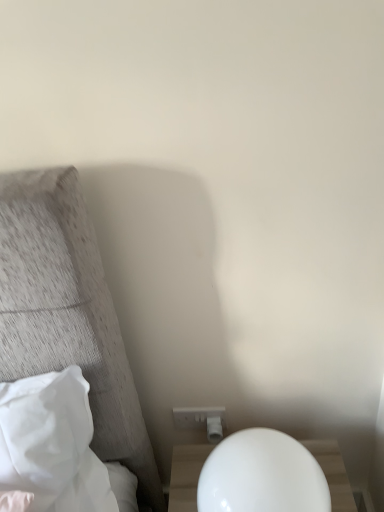
Question: Can you confirm if white plastic electric outlet at lower center is smaller than white soft pillow at left?

Choices:
 (A) yes
 (B) no

Answer: (A)

Question: Is white plastic electric outlet at lower center to the left of white soft pillow at left from the viewer's perspective?

Choices:
 (A) no
 (B) yes

Answer: (A)

Question: Considering the relative sizes of white plastic electric outlet at lower center and white soft pillow at left in the image provided, is white plastic electric outlet at lower center wider than white soft pillow at left?

Choices:
 (A) yes
 (B) no

Answer: (B)

Question: From the image's perspective, is white plastic electric outlet at lower center located beneath white soft pillow at left?

Choices:
 (A) yes
 (B) no

Answer: (A)

Question: Is white plastic electric outlet at lower center shorter than white soft pillow at left?

Choices:
 (A) yes
 (B) no

Answer: (A)

Question: Is white plastic electric outlet at lower center wider or thinner than white soft pillow at left?

Choices:
 (A) thin
 (B) wide

Answer: (A)

Question: Considering the positions of white plastic electric outlet at lower center and white soft pillow at left in the image, is white plastic electric outlet at lower center taller or shorter than white soft pillow at left?

Choices:
 (A) tall
 (B) short

Answer: (B)

Question: Is point (188, 423) positioned closer to the camera than point (64, 449)?

Choices:
 (A) closer
 (B) farther

Answer: (B)

Question: From the image's perspective, is white plastic electric outlet at lower center above or below white soft pillow at left?

Choices:
 (A) below
 (B) above

Answer: (A)

Question: Is white glossy nightstand at lower right inside the boundaries of white plastic electric outlet at lower center, or outside?

Choices:
 (A) outside
 (B) inside

Answer: (A)

Question: Is point (173, 494) closer or farther from the camera than point (208, 417)?

Choices:
 (A) farther
 (B) closer

Answer: (B)

Question: Is white glossy nightstand at lower right in front of or behind white plastic electric outlet at lower center in the image?

Choices:
 (A) front
 (B) behind

Answer: (A)

Question: In terms of height, does white glossy nightstand at lower right look taller or shorter compared to white plastic electric outlet at lower center?

Choices:
 (A) tall
 (B) short

Answer: (A)

Question: From the image's perspective, is white soft pillow at left above or below white glossy nightstand at lower right?

Choices:
 (A) above
 (B) below

Answer: (A)

Question: Relative to white glossy nightstand at lower right, is white soft pillow at left in front or behind?

Choices:
 (A) behind
 (B) front

Answer: (A)